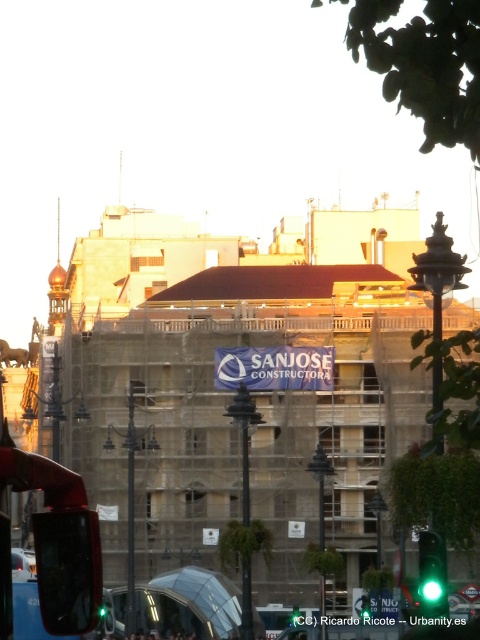
Based on the photo, can you confirm if shiny red bus at lower left is shorter than green glass traffic light at lower right?

Incorrect, shiny red bus at lower left's height does not fall short of green glass traffic light at lower right's.

Which is behind, point (69, 497) or point (445, 556)?

Point (445, 556)

Which is behind, point (44, 470) or point (424, 566)?

Positioned behind is point (424, 566).

Identify the location of shiny red bus at lower left. The width and height of the screenshot is (480, 640). (60, 541).